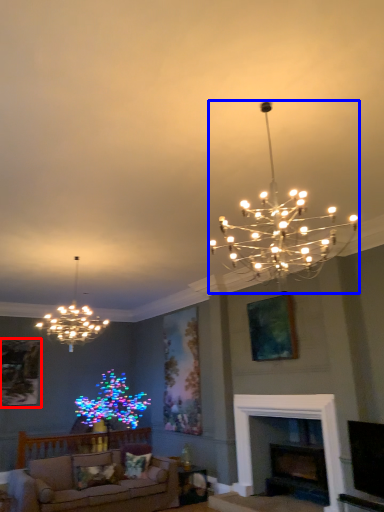
Question: Which point is further to the camera, picture frame (highlighted by a red box) or lamp (highlighted by a blue box)?

Choices:
 (A) picture frame
 (B) lamp

Answer: (A)